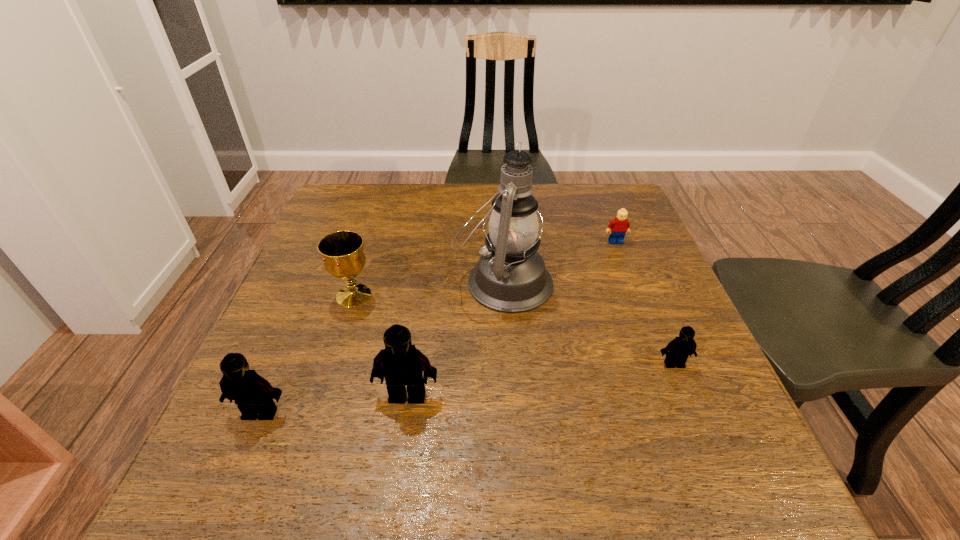
Locate which object is the fifth closest to the second farthest Lego. Please provide its 2D coordinates. Your answer should be formatted as a tuple, i.e. [(x, y)], where the tuple contains the x and y coordinates of a point satisfying the conditions above.

[(253, 395)]

Find the location of a particular element. object that stands as the third closest to the second farthest Lego is located at coordinates (400, 363).

Locate an element on the screen. The image size is (960, 540). Lego that can be found as the third closest to the second Lego from left to right is located at coordinates (620, 225).

The image size is (960, 540). What are the coordinates of `Lego that can be found as the third closest to the third object from right to left` in the screenshot? It's located at (680, 348).